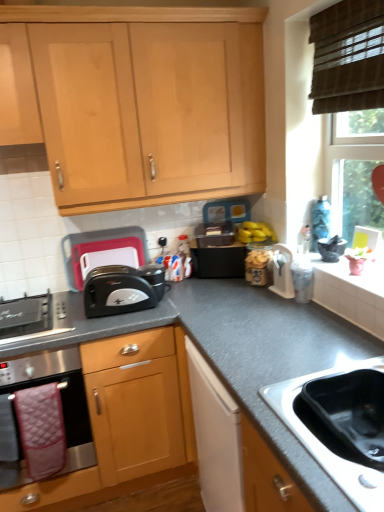
Question: Considering the relative sizes of black granite countertop at lower right, the 2th cabinetry positioned from the top, and black plastic toaster at center in the image provided, is black granite countertop at lower right, the 2th cabinetry positioned from the top, bigger than black plastic toaster at center?

Choices:
 (A) yes
 (B) no

Answer: (A)

Question: Is black granite countertop at lower right, the 1th cabinetry positioned from the bottom, positioned far away from black plastic toaster at center?

Choices:
 (A) yes
 (B) no

Answer: (B)

Question: Is black granite countertop at lower right, the 2th cabinetry positioned from the top, in contact with black plastic toaster at center?

Choices:
 (A) yes
 (B) no

Answer: (B)

Question: From a real-world perspective, is black granite countertop at lower right, the 2th cabinetry positioned from the top, physically above black plastic toaster at center?

Choices:
 (A) no
 (B) yes

Answer: (A)

Question: Is black granite countertop at lower right, the 1th cabinetry positioned from the bottom, wider than black plastic toaster at center?

Choices:
 (A) yes
 (B) no

Answer: (A)

Question: Is black plastic toaster at center completely or partially inside black granite countertop at lower right, the 2th cabinetry positioned from the top?

Choices:
 (A) no
 (B) yes

Answer: (A)

Question: Is black plastic toaster at center-left, acting as the second appliance starting from the front, thinner than gray granite countertop at center?

Choices:
 (A) yes
 (B) no

Answer: (A)

Question: Can gray granite countertop at center be found inside black plastic toaster at center-left, which appears as the 1th appliance when viewed from the back?

Choices:
 (A) no
 (B) yes

Answer: (A)

Question: From a real-world perspective, is black plastic toaster at center-left, acting as the second appliance starting from the front, physically above gray granite countertop at center?

Choices:
 (A) yes
 (B) no

Answer: (A)

Question: Is black plastic toaster at center-left, which appears as the 1th appliance when viewed from the back, positioned behind gray granite countertop at center?

Choices:
 (A) yes
 (B) no

Answer: (A)

Question: Is black plastic toaster at center-left, which appears as the 1th appliance when viewed from the back, facing towards gray granite countertop at center?

Choices:
 (A) no
 (B) yes

Answer: (A)

Question: Are black plastic toaster at center-left, which ranks as the 1th appliance in left-to-right order, and stainless steel sink at lower right located far from each other?

Choices:
 (A) no
 (B) yes

Answer: (B)